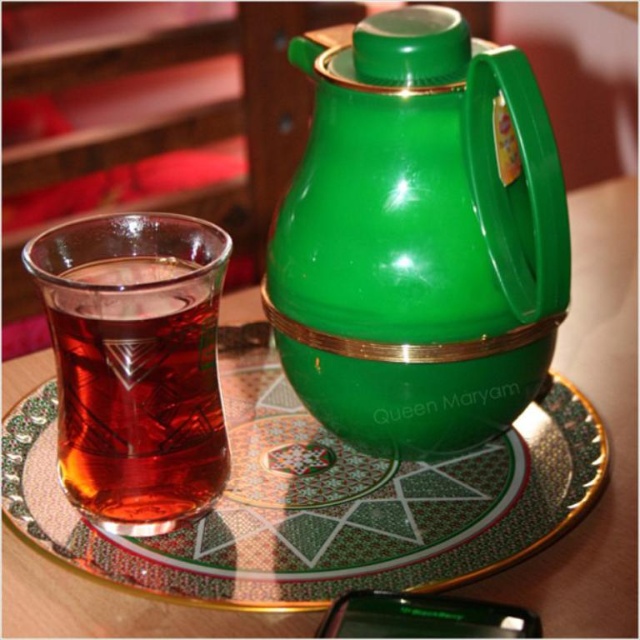
Between green glossy thermos at center and translucent glass cup at left, which one has less height?

translucent glass cup at left

Who is positioned more to the left, green glossy thermos at center or translucent glass cup at left?

translucent glass cup at left

Measure the distance between green glossy thermos at center and camera.

green glossy thermos at center and camera are 8.79 inches apart from each other.

Find the location of a particular element. The height and width of the screenshot is (640, 640). green glossy thermos at center is located at coordinates (419, 237).

Does green glossy thermos at center lie behind green glossy plate at center?

That is False.

Can you confirm if green glossy thermos at center is shorter than green glossy plate at center?

No, green glossy thermos at center is not shorter than green glossy plate at center.

Locate an element on the screen. The image size is (640, 640). green glossy thermos at center is located at coordinates (419, 237).

Where is `green glossy thermos at center`? The width and height of the screenshot is (640, 640). green glossy thermos at center is located at coordinates (419, 237).

Is green glossy plate at center thinner than translucent glass cup at left?

No, green glossy plate at center is not thinner than translucent glass cup at left.

Looking at this image, is green glossy plate at center smaller than translucent glass cup at left?

Actually, green glossy plate at center might be larger than translucent glass cup at left.

The height and width of the screenshot is (640, 640). I want to click on green glossy plate at center, so click(320, 499).